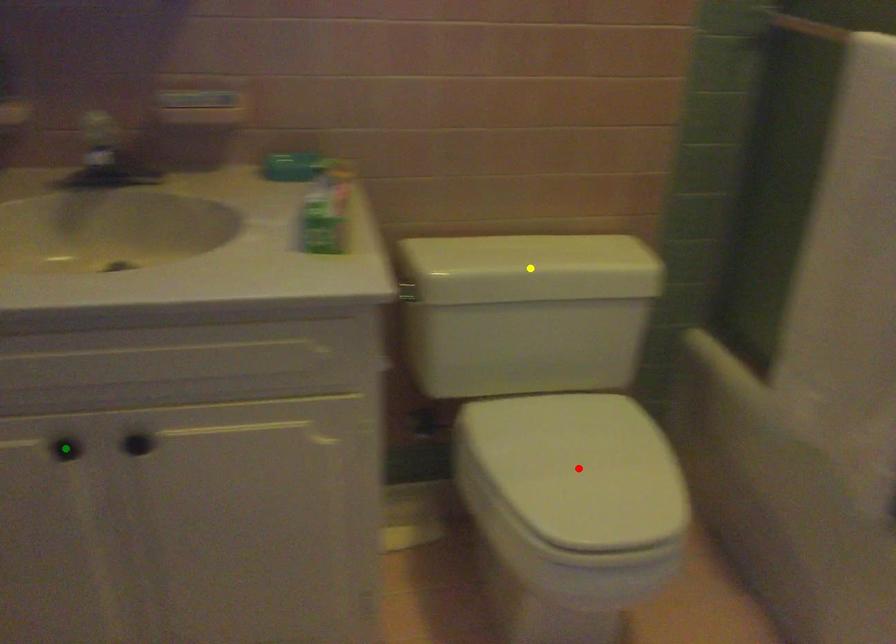
Order these from nearest to farthest:
A) yellow point
B) red point
C) green point

1. yellow point
2. red point
3. green point